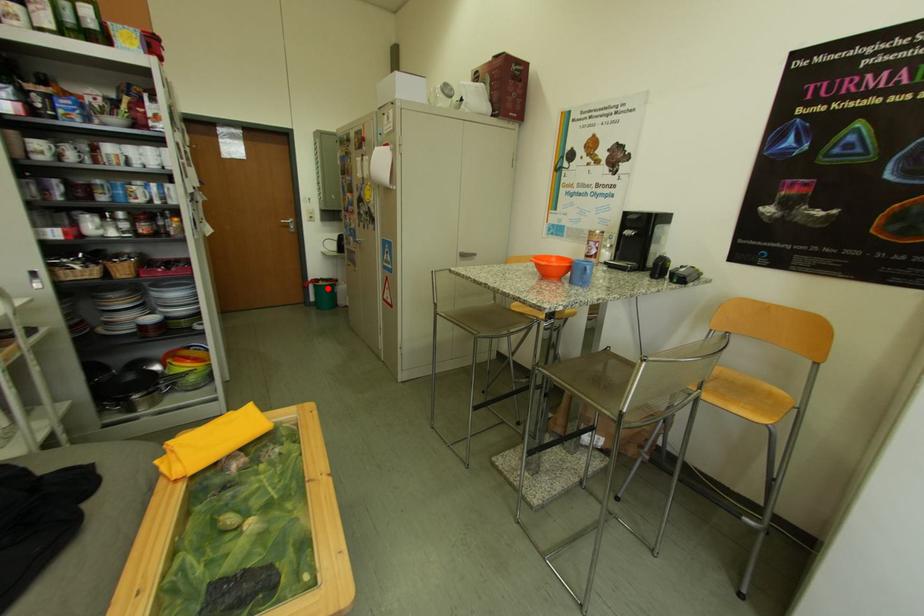
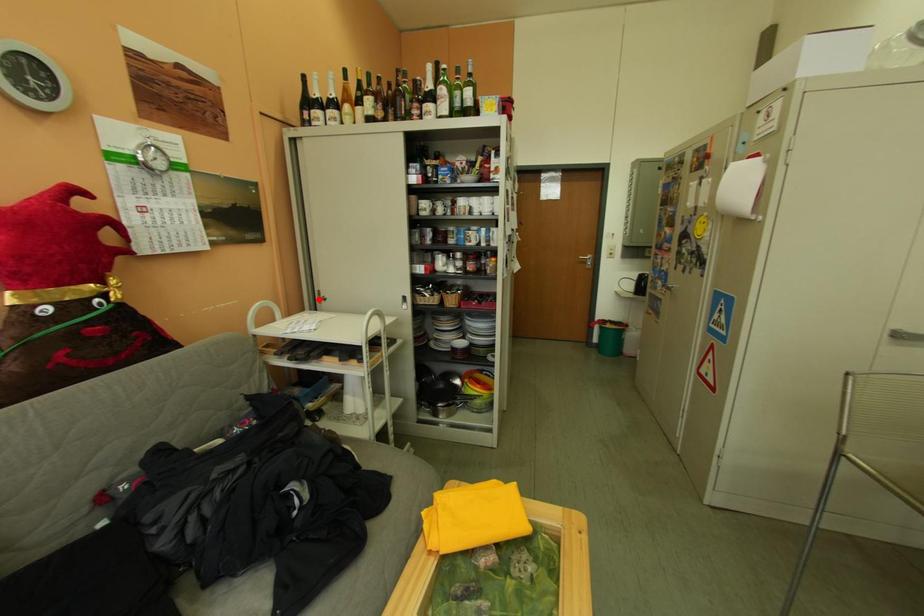
I am providing you with two images of the same scene from different viewpoints. A red point is marked on the first image and another point is marked on the second image. Do the highlighted points in image1 and image2 indicate the same real-world spot?

No